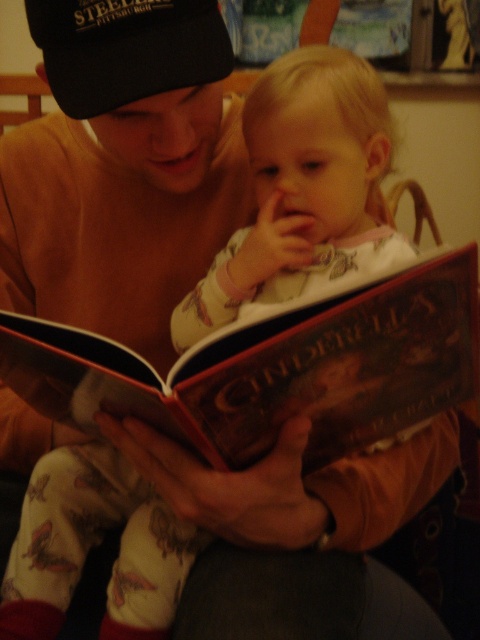
Question: Which point is farther from the camera taking this photo?

Choices:
 (A) (466, 314)
 (B) (140, 346)
 (C) (79, 83)

Answer: (B)

Question: Can you confirm if hardcover book at center is thinner than black fabric baseball cap at upper left?

Choices:
 (A) yes
 (B) no

Answer: (B)

Question: Which point is closer to the camera?

Choices:
 (A) (106, 32)
 (B) (202, 13)

Answer: (A)

Question: Considering the relative positions of matte brown sweater at upper left and black fabric baseball cap at upper left in the image provided, where is matte brown sweater at upper left located with respect to black fabric baseball cap at upper left?

Choices:
 (A) below
 (B) above

Answer: (A)

Question: Which object is closer to the camera taking this photo?

Choices:
 (A) hardcover book at center
 (B) matte brown sweater at upper left
 (C) black fabric baseball cap at upper left

Answer: (A)

Question: From the image, what is the correct spatial relationship of matte brown sweater at upper left in relation to black fabric baseball cap at upper left?

Choices:
 (A) below
 (B) above

Answer: (A)